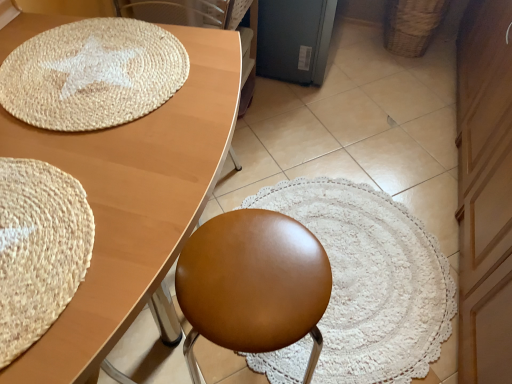
You are a GUI agent. You are given a task and a screenshot of the screen. Output one action in this format:
    pyautogui.click(x=<x>, y=<y>)
    Task: Click on the matte wood table at upper left
    
    Given the screenshot: What is the action you would take?
    pyautogui.click(x=134, y=205)

This screenshot has width=512, height=384. What do you see at coordinates (253, 284) in the screenshot? I see `satin brown stool at center` at bounding box center [253, 284].

In order to face satin brown stool at center, should I rotate leftwards or rightwards?

You should rotate left by 0.669 degrees.

Find the location of a particular element. brown leather swivel chair at upper center is located at coordinates (179, 12).

Find the location of a particular element. The image size is (512, 384). natural fiber mat at upper left, which ranks as the second mat in bottom-to-top order is located at coordinates (92, 74).

The image size is (512, 384). I want to click on matte wood table at upper left, so click(x=134, y=205).

Would you say matte wood table at upper left is outside brown leather swivel chair at upper center?

Absolutely, matte wood table at upper left is external to brown leather swivel chair at upper center.

Is matte wood table at upper left smaller than brown leather swivel chair at upper center?

No, matte wood table at upper left is not smaller than brown leather swivel chair at upper center.

Is matte wood table at upper left shorter than brown leather swivel chair at upper center?

No.

From a real-world perspective, which is physically below, matte wood table at upper left or brown leather swivel chair at upper center?

From a 3D spatial view, matte wood table at upper left is below.

From a real-world perspective, between beige woven mat at lower left, which is the 2th mat in back-to-front order, and matte wood table at upper left, who is vertically higher?

beige woven mat at lower left, which is the 2th mat in back-to-front order, from a real-world perspective.

Based on the photo, does beige woven mat at lower left, the second mat from the top, touch matte wood table at upper left?

No, beige woven mat at lower left, the second mat from the top, is not next to matte wood table at upper left.

Which object is further away from the camera taking this photo, beige woven mat at lower left, which is the 2th mat in back-to-front order, or matte wood table at upper left?

matte wood table at upper left is more distant.

Between brown leather swivel chair at upper center and matte wood table at upper left, which one has larger width?

Wider between the two is matte wood table at upper left.

From the image's perspective, does brown leather swivel chair at upper center appear lower than matte wood table at upper left?

No.

Does brown leather swivel chair at upper center come in front of matte wood table at upper left?

No.

Measure the distance between brown leather swivel chair at upper center and matte wood table at upper left.

36.34 centimeters.

From the image's perspective, which mat is the 1st one above the satin brown stool at center? Please provide its 2D coordinates.

[(39, 249)]

Which object is positioned more to the left, beige woven mat at lower left, which is the 2th mat in back-to-front order, or satin brown stool at center?

Positioned to the left is beige woven mat at lower left, which is the 2th mat in back-to-front order.

Is beige woven mat at lower left, the 1th mat in the front-to-back sequence, far away from satin brown stool at center?

No, there isn't a large distance between beige woven mat at lower left, the 1th mat in the front-to-back sequence, and satin brown stool at center.

Does point (24, 253) come behind point (232, 243)?

No, it is in front of (232, 243).

Does satin brown stool at center turn towards wooden dresser at right?

No, satin brown stool at center does not turn towards wooden dresser at right.

Considering the positions of objects satin brown stool at center and wooden dresser at right in the image provided, who is more to the right, satin brown stool at center or wooden dresser at right?

wooden dresser at right.

Who is taller, satin brown stool at center or wooden dresser at right?

With more height is wooden dresser at right.

Where is `table above the satin brown stool at center (from the image's perspective)`? The image size is (512, 384). table above the satin brown stool at center (from the image's perspective) is located at coordinates (134, 205).

Could you tell me if matte wood table at upper left is facing satin brown stool at center?

Yes, matte wood table at upper left is turned towards satin brown stool at center.

Considering the sizes of matte wood table at upper left and satin brown stool at center in the image, is matte wood table at upper left taller or shorter than satin brown stool at center?

Clearly, matte wood table at upper left is taller compared to satin brown stool at center.

Looking at their sizes, would you say matte wood table at upper left is wider or thinner than satin brown stool at center?

Clearly, matte wood table at upper left has more width compared to satin brown stool at center.

Considering the sizes of woven brown basket at upper right and natural fiber mat at upper left, which is the first mat in top-to-bottom order, in the image, is woven brown basket at upper right bigger or smaller than natural fiber mat at upper left, which is the first mat in top-to-bottom order,?

In the image, woven brown basket at upper right appears to be larger than natural fiber mat at upper left, which is the first mat in top-to-bottom order.

Is woven brown basket at upper right aimed at natural fiber mat at upper left, the first mat when ordered from back to front?

No, woven brown basket at upper right is not oriented towards natural fiber mat at upper left, the first mat when ordered from back to front.

In the scene shown: Between woven brown basket at upper right and natural fiber mat at upper left, the first mat when ordered from back to front, which one has larger width?

natural fiber mat at upper left, the first mat when ordered from back to front, is wider.

Where is `the 1st mat directly above the woven brown basket at upper right (from a real-world perspective)`? the 1st mat directly above the woven brown basket at upper right (from a real-world perspective) is located at coordinates (92, 74).

In order to click on swivel chair above the matte wood table at upper left (from the image's perspective) in this screenshot , I will do `click(179, 12)`.

Find the location of a particular element. The width and height of the screenshot is (512, 384). table behind the beige woven mat at lower left, which is the 2th mat in back-to-front order is located at coordinates (134, 205).

When comparing their distances from satin brown stool at center, does woven brown basket at upper right or brown leather swivel chair at upper center seem further?

woven brown basket at upper right.

Based on their spatial positions, is beige woven mat at lower left, arranged as the 1th mat when ordered from the bottom, or matte wood table at upper left further from satin brown stool at center?

beige woven mat at lower left, arranged as the 1th mat when ordered from the bottom, lies further to satin brown stool at center than the other object.

In the scene shown: From the image, which object appears to be farther from beige woven mat at lower left, arranged as the 1th mat when ordered from the bottom, woven brown basket at upper right or matte wood table at upper left?

woven brown basket at upper right lies further to beige woven mat at lower left, arranged as the 1th mat when ordered from the bottom, than the other object.

Estimate the real-world distances between objects in this image. Which object is closer to natural fiber mat at upper left, which is the second mat in front-to-back order, woven brown basket at upper right or wooden dresser at right?

The object closer to natural fiber mat at upper left, which is the second mat in front-to-back order, is wooden dresser at right.

When comparing their distances from brown leather swivel chair at upper center, does matte wood table at upper left or wooden dresser at right seem further?

The object further to brown leather swivel chair at upper center is wooden dresser at right.

Estimate the real-world distances between objects in this image. Which object is closer to natural fiber mat at upper left, which is the second mat in front-to-back order, satin brown stool at center or beige woven mat at lower left, which is the 2th mat in back-to-front order?

The object closer to natural fiber mat at upper left, which is the second mat in front-to-back order, is beige woven mat at lower left, which is the 2th mat in back-to-front order.

When comparing their distances from satin brown stool at center, does woven brown basket at upper right or natural fiber mat at upper left, which is the first mat in top-to-bottom order, seem closer?

natural fiber mat at upper left, which is the first mat in top-to-bottom order, is closer to satin brown stool at center.

Based on their spatial positions, is woven brown basket at upper right or wooden dresser at right further from satin brown stool at center?

woven brown basket at upper right is further to satin brown stool at center.

The height and width of the screenshot is (384, 512). In order to click on dresser between matte wood table at upper left and woven brown basket at upper right from front to back in this screenshot , I will do `click(485, 191)`.

You are a GUI agent. You are given a task and a screenshot of the screen. Output one action in this format:
    pyautogui.click(x=<x>, y=<y>)
    Task: Click on the mat between natural fiber mat at upper left, which is the first mat in top-to-bottom order, and satin brown stool at center in the up-down direction
    
    Given the screenshot: What is the action you would take?
    pyautogui.click(x=39, y=249)

At what (x,y) coordinates should I click in order to perform the action: click on table between natural fiber mat at upper left, the first mat when ordered from back to front, and satin brown stool at center from top to bottom. Please return your answer as a coordinate pair (x, y). The image size is (512, 384). Looking at the image, I should click on (134, 205).

What are the coordinates of `chair between brown leather swivel chair at upper center and wooden dresser at right` in the screenshot? It's located at (253, 284).